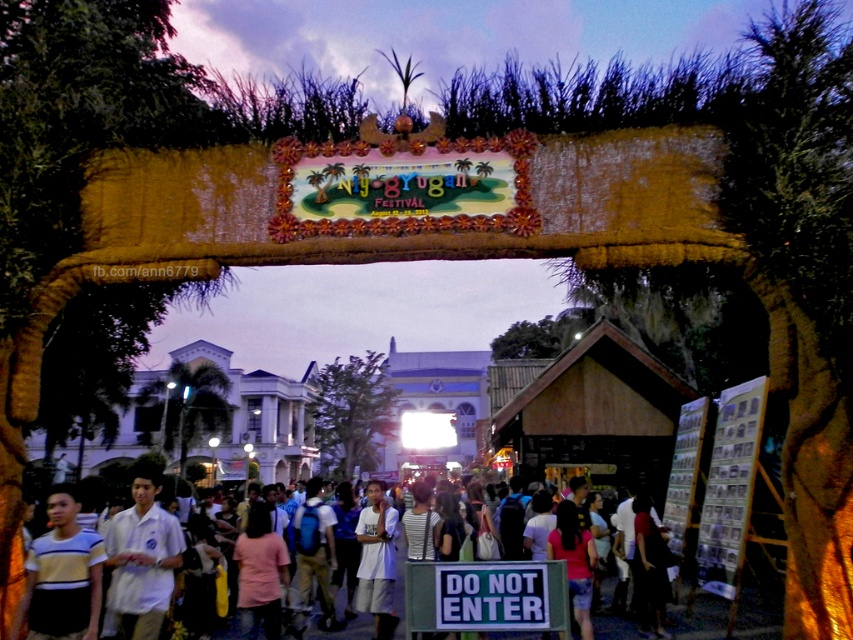
Question: Which point appears farthest from the camera in this image?

Choices:
 (A) (248, 524)
 (B) (128, 608)

Answer: (A)

Question: Does white cotton shirt at center have a larger size compared to white matte shirt at center?

Choices:
 (A) no
 (B) yes

Answer: (B)

Question: Which of these objects is positioned farthest from the striped jersey at center?

Choices:
 (A) white matte shirt at center
 (B) white cotton shirt at center
 (C) white matte shirt at lower left

Answer: (A)

Question: Which of the following is the farthest from the observer?

Choices:
 (A) white matte shirt at lower left
 (B) striped jersey at center

Answer: (A)

Question: Observing the image, what is the correct spatial positioning of white cotton shirt at center in reference to white matte shirt at center?

Choices:
 (A) right
 (B) left

Answer: (A)

Question: Is striped jersey at center thinner than white cotton shirt at center?

Choices:
 (A) yes
 (B) no

Answer: (A)